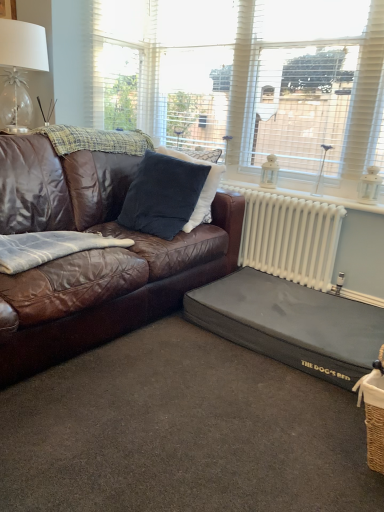
Question: From their relative heights in the image, would you say plaid woolen blanket at upper left, which is counted as the 2th blanket, starting from the bottom, is taller or shorter than white metallic radiator at right?

Choices:
 (A) short
 (B) tall

Answer: (A)

Question: From the image's perspective, is plaid woolen blanket at upper left, which is counted as the first blanket, starting from the top, positioned above or below white metallic radiator at right?

Choices:
 (A) above
 (B) below

Answer: (A)

Question: Which object is positioned farthest from the white textured window at upper center, arranged as the second window when viewed from the left?

Choices:
 (A) white metallic radiator at right
 (B) black fabric dog bed at lower right
 (C) velvety dark blue pillow at center
 (D) plaid woolen blanket at upper left, which is counted as the 2th blanket, starting from the front
 (E) denim fabric blanket at left, the first blanket positioned from the front

Answer: (E)

Question: Estimate the real-world distances between objects in this image. Which object is closer to the white textured window at upper center, which is counted as the first window, starting from the left?

Choices:
 (A) white textured window at upper center, arranged as the second window when viewed from the left
 (B) white metallic radiator at right
 (C) clear glass table lamp at upper left
 (D) black fabric dog bed at lower right
 (E) velvety dark blue pillow at center

Answer: (A)